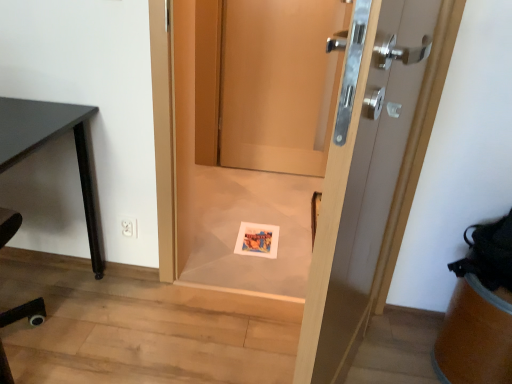
The width and height of the screenshot is (512, 384). I want to click on vacant region under matte black desk at left (from a real-world perspective), so click(x=32, y=301).